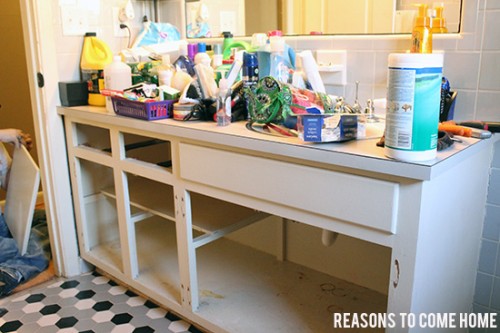
Where is `hexagon tile floor`? The height and width of the screenshot is (333, 500). hexagon tile floor is located at coordinates (102, 317).